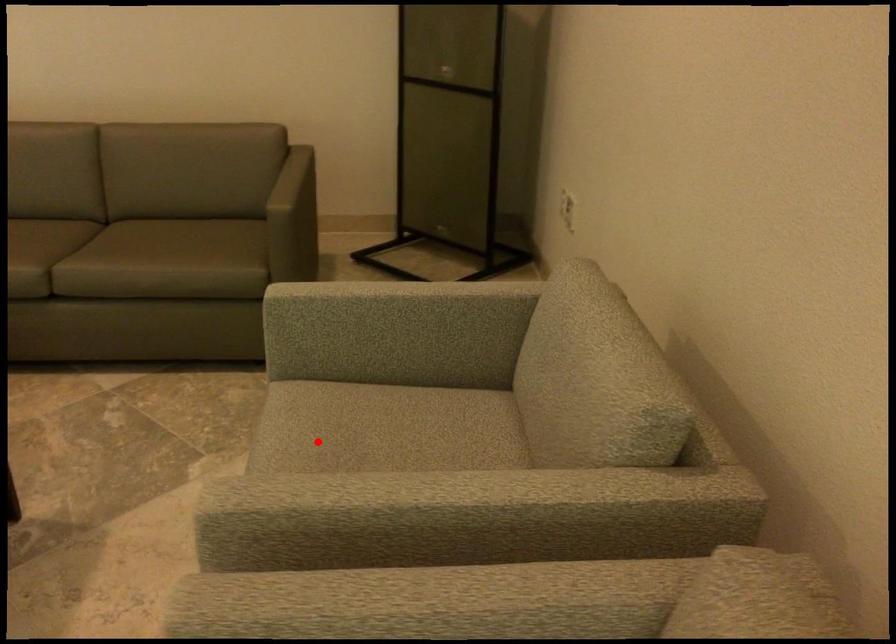
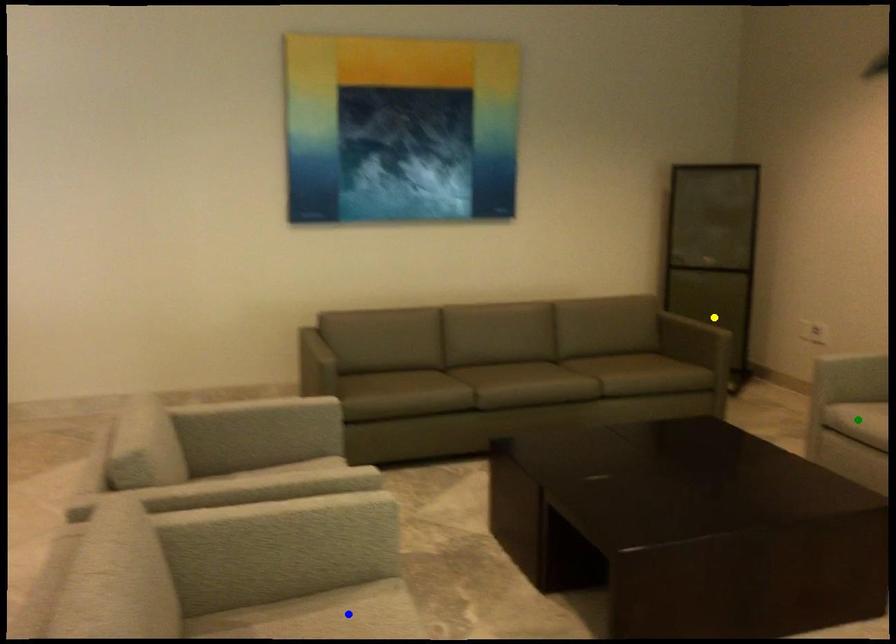
Question: I am providing you with two images of the same scene from different viewpoints. A red point is marked on the first image. You are given multiple points on the second image. Which spot in image 2 lines up with the point in image 1?

Choices:
 (A) blue point
 (B) yellow point
 (C) green point

Answer: (C)